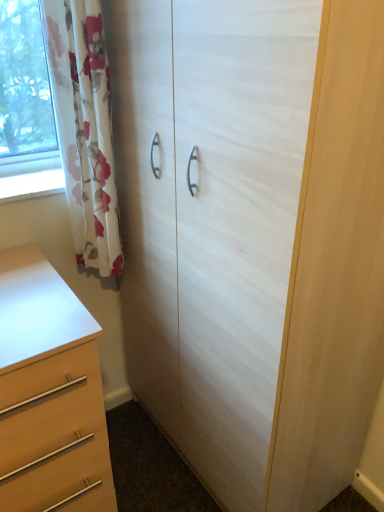
Question: In terms of width, does white wood cupboard at center look wider or thinner when compared to floral fabric curtain at left?

Choices:
 (A) thin
 (B) wide

Answer: (B)

Question: From the image's perspective, is white wood cupboard at center above or below floral fabric curtain at left?

Choices:
 (A) below
 (B) above

Answer: (A)

Question: Based on their relative distances, which object is farther from the white wood cupboard at center?

Choices:
 (A) matte wood chest of drawers at lower left
 (B) floral fabric curtain at left

Answer: (A)

Question: Which object is positioned farthest from the matte wood chest of drawers at lower left?

Choices:
 (A) floral fabric curtain at left
 (B) white wood cupboard at center

Answer: (B)